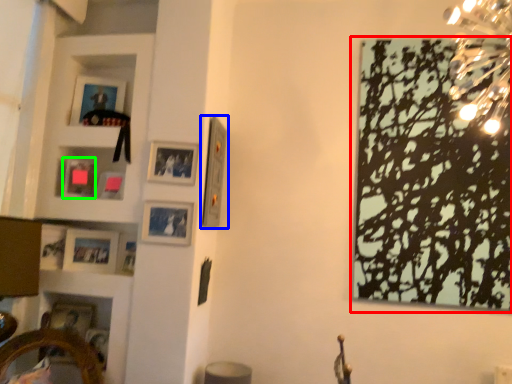
Question: Which object is the farthest from picture frame (highlighted by a red box)? Choose among these: picture frame (highlighted by a blue box) or picture frame (highlighted by a green box).

Choices:
 (A) picture frame
 (B) picture frame

Answer: (B)